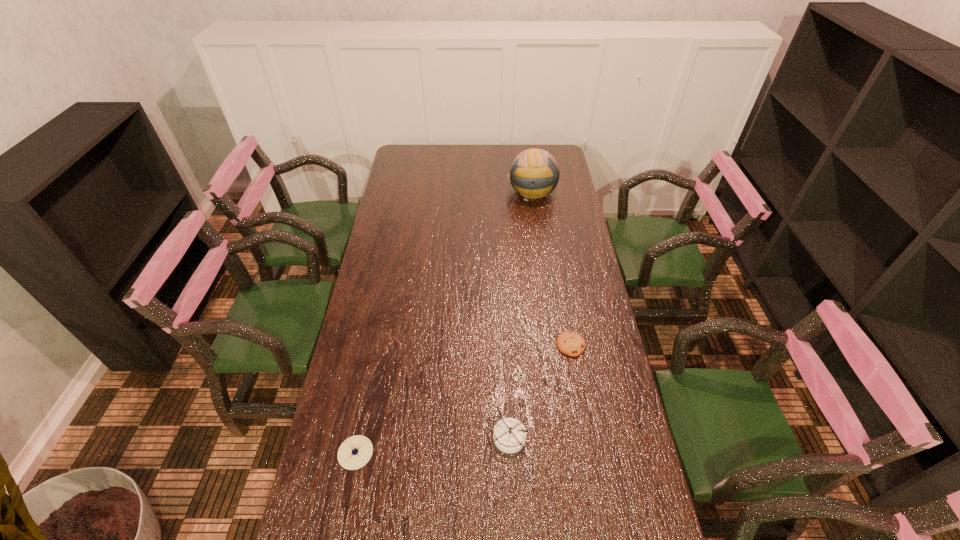
In order to click on free point between the shortest object and the tallest object in this screenshot , I will do `click(551, 268)`.

Identify the location of vacant space that is in between the right compass and the left compass. (432, 445).

Locate an element on the screen. The width and height of the screenshot is (960, 540). free space between the third nearest object and the farthest object is located at coordinates (551, 268).

I want to click on free space that is in between the third nearest object and the left compass, so click(463, 399).

The width and height of the screenshot is (960, 540). I want to click on vacant region between the taller compass and the farthest object, so click(x=519, y=314).

Locate an element on the screen. free space that is in between the volleyball and the cookie is located at coordinates (551, 268).

I want to click on vacant area that lies between the cookie and the volleyball, so click(x=551, y=268).

Where is `vacant area between the taller compass and the cookie`? vacant area between the taller compass and the cookie is located at coordinates (540, 391).

Image resolution: width=960 pixels, height=540 pixels. Find the location of `unoccupied area between the shortest object and the leftmost object`. unoccupied area between the shortest object and the leftmost object is located at coordinates (463, 399).

Identify which object is the closest to the shorter compass. Please provide its 2D coordinates. Your answer should be formatted as a tuple, i.e. [(x, y)], where the tuple contains the x and y coordinates of a point satisfying the conditions above.

[(509, 435)]